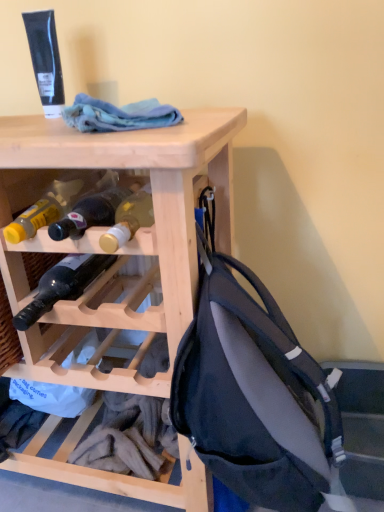
This screenshot has height=512, width=384. Identify the location of blue cotton cloth at upper center. (118, 115).

Find the location of a particular element. matte black backpack at right is located at coordinates (253, 394).

Is natural wood wine rack at upper center facing towards matte black backpack at right?

No.

Considering their positions, is natural wood wine rack at upper center located in front of or behind matte black backpack at right?

In the image, natural wood wine rack at upper center appears behind matte black backpack at right.

Are natural wood wine rack at upper center and matte black backpack at right far apart?

natural wood wine rack at upper center is actually quite close to matte black backpack at right.

Who is more distant, natural wood wine rack at upper center or blue cotton cloth at upper center?

blue cotton cloth at upper center.

Does natural wood wine rack at upper center have a smaller size compared to blue cotton cloth at upper center?

Incorrect, natural wood wine rack at upper center is not smaller in size than blue cotton cloth at upper center.

From the image's perspective, who appears lower, natural wood wine rack at upper center or blue cotton cloth at upper center?

natural wood wine rack at upper center is shown below in the image.

From a real-world perspective, does natural wood wine rack at upper center sit lower than blue cotton cloth at upper center?

Correct, in the physical world, natural wood wine rack at upper center is lower than blue cotton cloth at upper center.

Considering the relative sizes of matte black backpack at right and matte glass bottle at center, acting as the second bottle starting from the bottom, in the image provided, is matte black backpack at right wider than matte glass bottle at center, acting as the second bottle starting from the bottom,?

Incorrect, the width of matte black backpack at right does not surpass that of matte glass bottle at center, acting as the second bottle starting from the bottom.

Based on the photo, which is closer to the camera, (191, 353) or (73, 238)?

The point (191, 353) is in front.

Which of these two, matte black backpack at right or matte glass bottle at center, acting as the second bottle starting from the bottom, is smaller?

Smaller between the two is matte glass bottle at center, acting as the second bottle starting from the bottom.

From the image's perspective, which object appears higher, matte black backpack at right or matte glass bottle at center, acting as the second bottle starting from the bottom?

From the image's view, matte glass bottle at center, acting as the second bottle starting from the bottom, is above.

Can you confirm if matte glass bottle at center, acting as the second bottle starting from the bottom, is positioned to the right of dark glass bottle at center, acting as the 1th bottle starting from the bottom?

Yes.

Is matte glass bottle at center, acting as the second bottle starting from the bottom, spatially inside dark glass bottle at center, arranged as the 2th bottle when viewed from the top, or outside of it?

matte glass bottle at center, acting as the second bottle starting from the bottom, is spatially situated outside dark glass bottle at center, arranged as the 2th bottle when viewed from the top.

Which is behind, point (81, 201) or point (48, 277)?

The point (48, 277) is more distant.

Considering the relative sizes of matte glass bottle at center, the 1th bottle viewed from the top, and dark glass bottle at center, arranged as the 2th bottle when viewed from the top, in the image provided, is matte glass bottle at center, the 1th bottle viewed from the top, wider than dark glass bottle at center, arranged as the 2th bottle when viewed from the top,?

Indeed, matte glass bottle at center, the 1th bottle viewed from the top, has a greater width compared to dark glass bottle at center, arranged as the 2th bottle when viewed from the top.

Would you say blue cotton cloth at upper center contains natural wood wine rack at upper center?

Definitely not — natural wood wine rack at upper center is not inside blue cotton cloth at upper center.

Is blue cotton cloth at upper center to the right of natural wood wine rack at upper center from the viewer's perspective?

Indeed, blue cotton cloth at upper center is positioned on the right side of natural wood wine rack at upper center.

Is blue cotton cloth at upper center oriented away from natural wood wine rack at upper center?

blue cotton cloth at upper center does not have its back to natural wood wine rack at upper center.

From the image's perspective, is natural wood wine rack at upper center above dark glass bottle at center, acting as the 1th bottle starting from the bottom?

No, from the image's perspective, natural wood wine rack at upper center is not above dark glass bottle at center, acting as the 1th bottle starting from the bottom.

At what (x,y) coordinates should I click in order to perform the action: click on the 1st bottle above the natural wood wine rack at upper center (from the image's perspective). Please return your answer as a coordinate pair (x, y). The image size is (384, 512). Looking at the image, I should click on (63, 285).

Considering the sizes of objects natural wood wine rack at upper center and dark glass bottle at center, arranged as the 2th bottle when viewed from the top, in the image provided, who is smaller, natural wood wine rack at upper center or dark glass bottle at center, arranged as the 2th bottle when viewed from the top,?

dark glass bottle at center, arranged as the 2th bottle when viewed from the top, is smaller.

Can you confirm if natural wood wine rack at upper center is positioned to the left of dark glass bottle at center, arranged as the 2th bottle when viewed from the top?

Indeed, natural wood wine rack at upper center is positioned on the left side of dark glass bottle at center, arranged as the 2th bottle when viewed from the top.

Can you confirm if dark glass bottle at center, acting as the 1th bottle starting from the bottom, is bigger than matte glass bottle at center, the 1th bottle viewed from the top?

Incorrect, dark glass bottle at center, acting as the 1th bottle starting from the bottom, is not larger than matte glass bottle at center, the 1th bottle viewed from the top.

Can we say dark glass bottle at center, acting as the 1th bottle starting from the bottom, lies outside matte glass bottle at center, acting as the second bottle starting from the bottom?

Indeed, dark glass bottle at center, acting as the 1th bottle starting from the bottom, is completely outside matte glass bottle at center, acting as the second bottle starting from the bottom.

Is the surface of dark glass bottle at center, acting as the 1th bottle starting from the bottom, in direct contact with matte glass bottle at center, acting as the second bottle starting from the bottom?

No, dark glass bottle at center, acting as the 1th bottle starting from the bottom, is not touching matte glass bottle at center, acting as the second bottle starting from the bottom.

Does point (74, 267) appear closer or farther from the camera than point (89, 207)?

Point (74, 267) appears to be farther away from the viewer than point (89, 207).

Locate an element on the screen. Image resolution: width=384 pixels, height=512 pixels. backpack below the natural wood wine rack at upper center (from the image's perspective) is located at coordinates (253, 394).

Identify the location of cloth behind the natural wood wine rack at upper center. (118, 115).

Based on their spatial positions, is matte glass bottle at center, acting as the second bottle starting from the bottom, or dark glass bottle at center, arranged as the 2th bottle when viewed from the top, further from blue cotton cloth at upper center?

Based on the image, dark glass bottle at center, arranged as the 2th bottle when viewed from the top, appears to be further to blue cotton cloth at upper center.

Based on their spatial positions, is dark glass bottle at center, arranged as the 2th bottle when viewed from the top, or matte black backpack at right further from blue cotton cloth at upper center?

matte black backpack at right lies further to blue cotton cloth at upper center than the other object.

When comparing their distances from blue cotton cloth at upper center, does natural wood wine rack at upper center or matte black backpack at right seem closer?

natural wood wine rack at upper center lies closer to blue cotton cloth at upper center than the other object.

When comparing their distances from blue cotton cloth at upper center, does natural wood wine rack at upper center or dark glass bottle at center, arranged as the 2th bottle when viewed from the top, seem further?

dark glass bottle at center, arranged as the 2th bottle when viewed from the top, lies further to blue cotton cloth at upper center than the other object.

Looking at the image, which one is located further to matte glass bottle at center, acting as the second bottle starting from the bottom, dark glass bottle at center, acting as the 1th bottle starting from the bottom, or blue cotton cloth at upper center?

The object further to matte glass bottle at center, acting as the second bottle starting from the bottom, is dark glass bottle at center, acting as the 1th bottle starting from the bottom.

Looking at the image, which one is located closer to matte glass bottle at center, acting as the second bottle starting from the bottom, natural wood wine rack at upper center or blue cotton cloth at upper center?

The object closer to matte glass bottle at center, acting as the second bottle starting from the bottom, is blue cotton cloth at upper center.

Looking at the image, which one is located further to natural wood wine rack at upper center, matte black backpack at right or dark glass bottle at center, arranged as the 2th bottle when viewed from the top?

dark glass bottle at center, arranged as the 2th bottle when viewed from the top, is further to natural wood wine rack at upper center.

Looking at the image, which one is located further to matte black backpack at right, natural wood wine rack at upper center or dark glass bottle at center, acting as the 1th bottle starting from the bottom?

Based on the image, dark glass bottle at center, acting as the 1th bottle starting from the bottom, appears to be further to matte black backpack at right.

This screenshot has width=384, height=512. In order to click on bottle located between dark glass bottle at center, arranged as the 2th bottle when viewed from the top, and matte black backpack at right in the left-right direction in this screenshot , I will do `click(89, 214)`.

Identify the location of bottle between matte glass bottle at center, the 1th bottle viewed from the top, and natural wood wine rack at upper center in the up-down direction. (63, 285).

Where is `desk that lies between blue cotton cloth at upper center and matte black backpack at right from top to bottom`? desk that lies between blue cotton cloth at upper center and matte black backpack at right from top to bottom is located at coordinates (125, 245).

The width and height of the screenshot is (384, 512). What are the coordinates of `bottle between blue cotton cloth at upper center and dark glass bottle at center, acting as the 1th bottle starting from the bottom, vertically` in the screenshot? It's located at (89, 214).